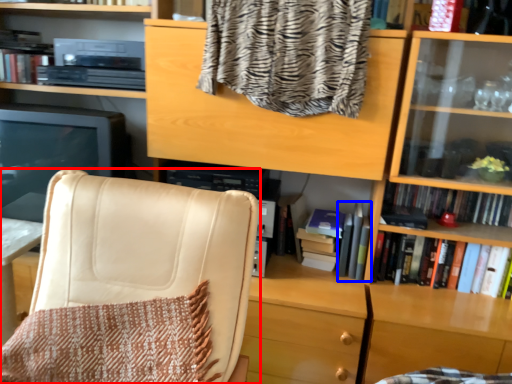
Question: Among these objects, which one is nearest to the camera, chair (highlighted by a red box) or book (highlighted by a blue box)?

Choices:
 (A) chair
 (B) book

Answer: (A)